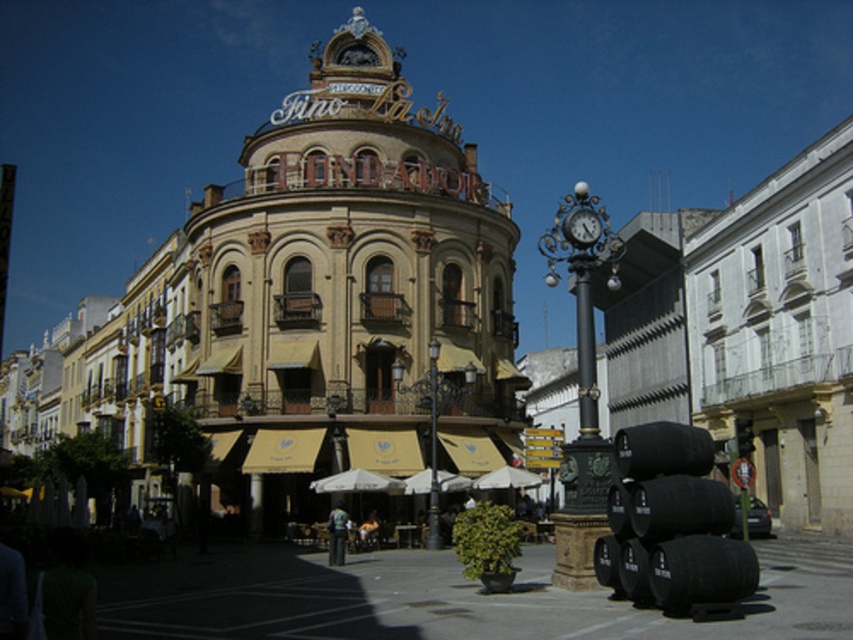
Question: Can you confirm if gold metallic sign at center is wider than metallic clock at center-right?

Choices:
 (A) yes
 (B) no

Answer: (A)

Question: Does gold metallic sign at center come in front of metallic clock at center-right?

Choices:
 (A) yes
 (B) no

Answer: (B)

Question: Is gold metallic sign at center to the left of metallic clock at center-right from the viewer's perspective?

Choices:
 (A) yes
 (B) no

Answer: (A)

Question: Which point appears closest to the camera in this image?

Choices:
 (A) (308, 209)
 (B) (589, 243)

Answer: (B)